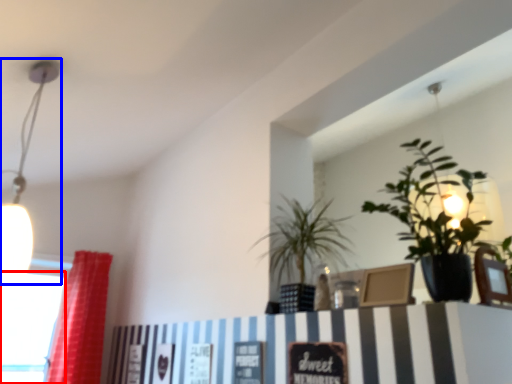
Question: Which object appears farthest to the camera in this image, window (highlighted by a red box) or lamp (highlighted by a blue box)?

Choices:
 (A) window
 (B) lamp

Answer: (A)